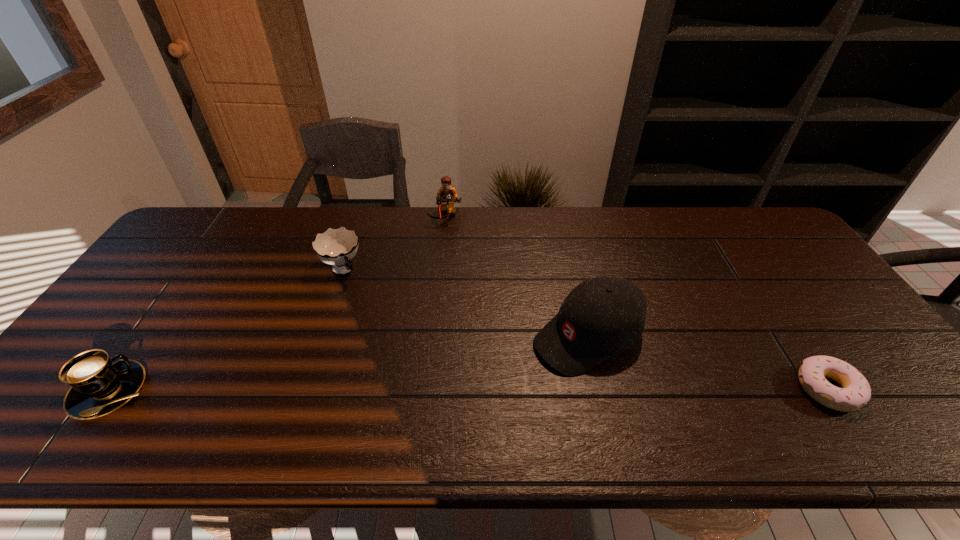
Locate an element on the screen. The width and height of the screenshot is (960, 540). cappuccino at the near edge is located at coordinates (100, 385).

Locate an element on the screen. The image size is (960, 540). doughnut present at the near edge is located at coordinates (855, 393).

The image size is (960, 540). Find the location of `baseball cap located at the near edge`. baseball cap located at the near edge is located at coordinates (603, 316).

Find the location of a particular element. This screenshot has width=960, height=540. object that is at the left edge is located at coordinates (100, 385).

Where is `object present at the right edge`? The height and width of the screenshot is (540, 960). object present at the right edge is located at coordinates (855, 393).

Locate an element on the screen. This screenshot has width=960, height=540. object that is at the near left corner is located at coordinates (100, 385).

Locate an element on the screen. object located at the near right corner is located at coordinates [x=855, y=393].

At what (x,y) coordinates should I click in order to perform the action: click on vacant space at the far edge of the desktop. Please return your answer as a coordinate pair (x, y). Looking at the image, I should click on (511, 211).

Find the location of a particular element. The width and height of the screenshot is (960, 540). vacant space at the near edge of the desktop is located at coordinates tap(319, 395).

Locate an element on the screen. Image resolution: width=960 pixels, height=540 pixels. vacant area at the left edge of the desktop is located at coordinates (114, 338).